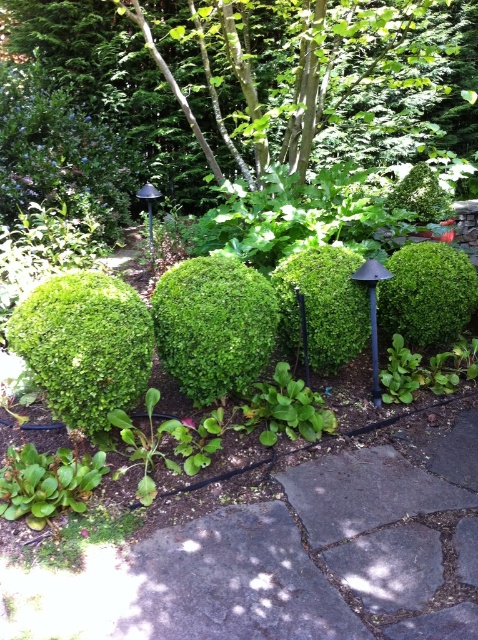
Question: Which point is closer to the camera taking this photo?

Choices:
 (A) 28,132
 (B) 333,298
 (C) 239,369
 (D) 83,381

Answer: (D)

Question: Which of the following is the closest to the observer?

Choices:
 (A) green leafy shrub at upper center
 (B) green leafy shrub at center
 (C) green matte shrub at center
 (D) green fuzzy bush at left

Answer: (D)

Question: Based on their relative distances, which object is farther from the green matte shrub at center?

Choices:
 (A) green leafy shrub at upper center
 (B) green leafy shrub at center
 (C) green fuzzy bush at left
 (D) green leafy tree at upper center

Answer: (D)

Question: Does green matte shrub at center come in front of green leafy shrub at center?

Choices:
 (A) yes
 (B) no

Answer: (A)

Question: Is green leafy shrub at center above green leafy shrub at upper center?

Choices:
 (A) yes
 (B) no

Answer: (B)

Question: Is green fuzzy bush at left to the left of green matte shrub at center from the viewer's perspective?

Choices:
 (A) no
 (B) yes

Answer: (B)